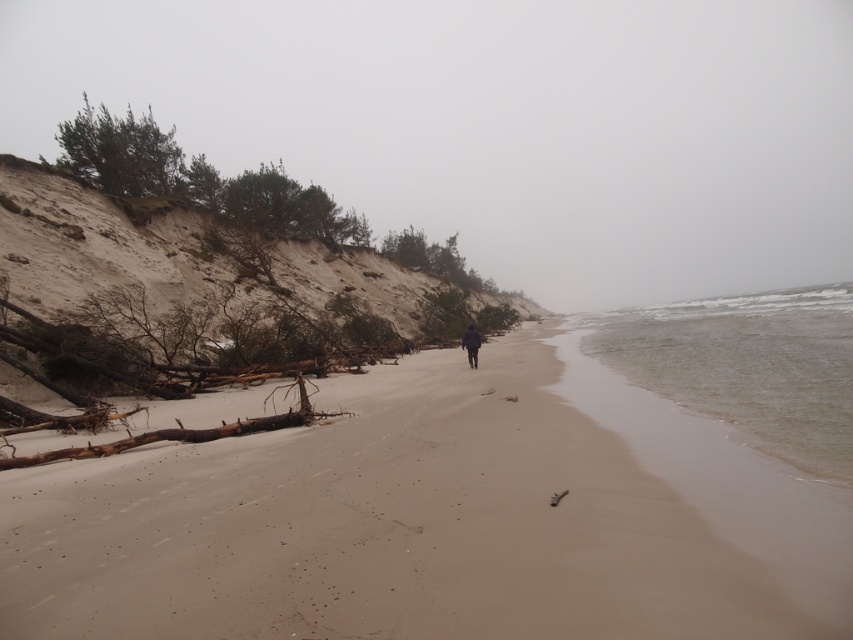
What is the 2D coordinate of the sandy beach at center?

The sandy beach at center is located at the 2D coordinate point of (x=424, y=524).

You are a hiker who wants to lay down your dark matte jacket at center on the sandy beach at center. Will the jacket cover the entire beach area when placed there?

The sandy beach at center is not as tall as dark matte jacket at center, so the jacket will not cover the entire beach area because the beach is shorter in height compared to the jacket.

You are standing on the beach and want to reach the clear water at lower right without getting your dark matte jacket at center wet. Which direction should you move towards?

You should move towards the right since the clear water at lower right is to the right of the dark matte jacket at center.